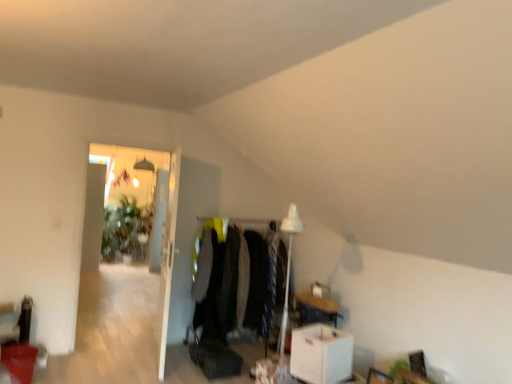
The height and width of the screenshot is (384, 512). I want to click on vacant space in transparent glass door at left (from a real-world perspective), so click(x=102, y=343).